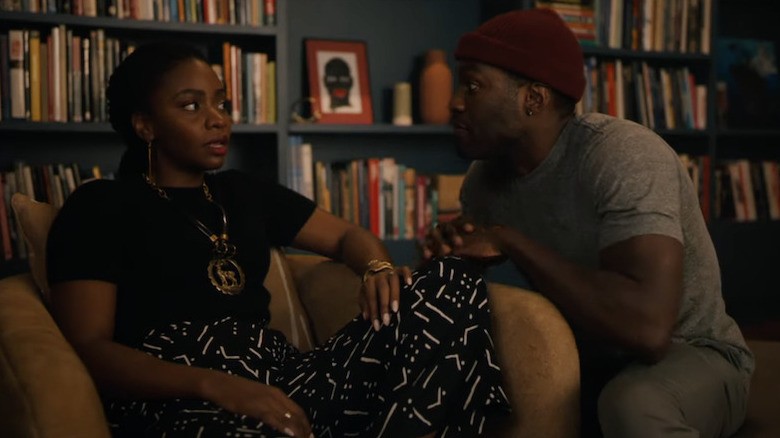
Identify the location of book. This screenshot has height=438, width=780. (80, 84).